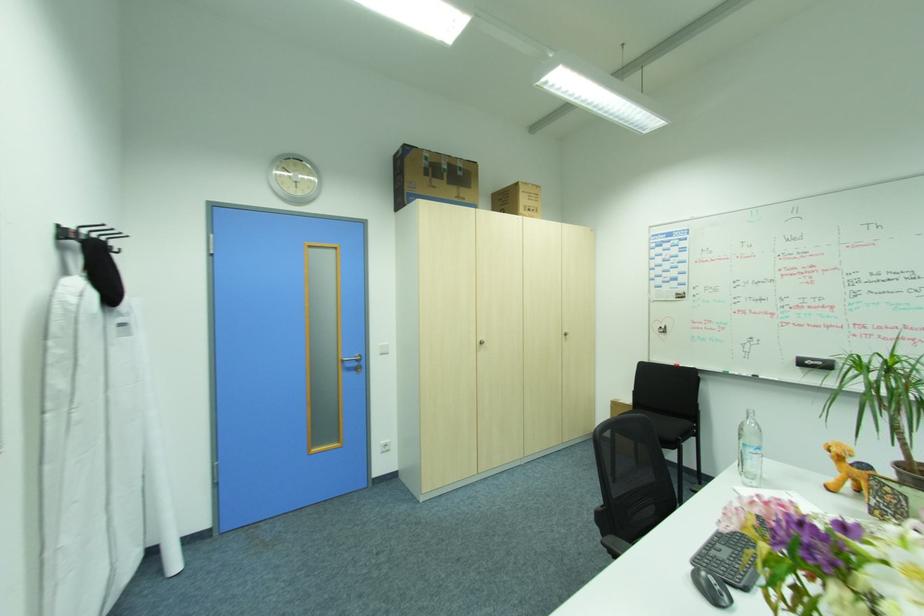
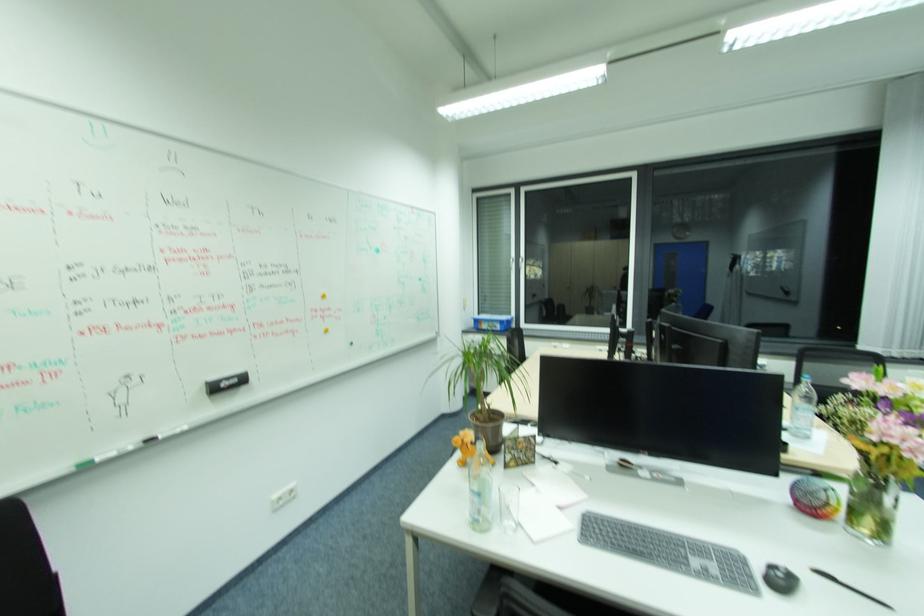
The point at [824,363] is marked in the first image. Where is the corresponding point in the second image?

(240, 381)